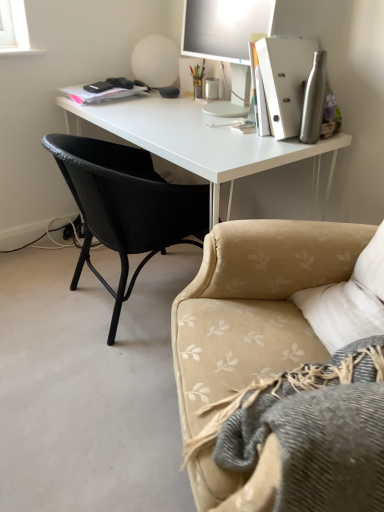
The image size is (384, 512). What are the coordinates of `free spot below black woven chair at left (from a real-world perspective)` in the screenshot? It's located at (109, 308).